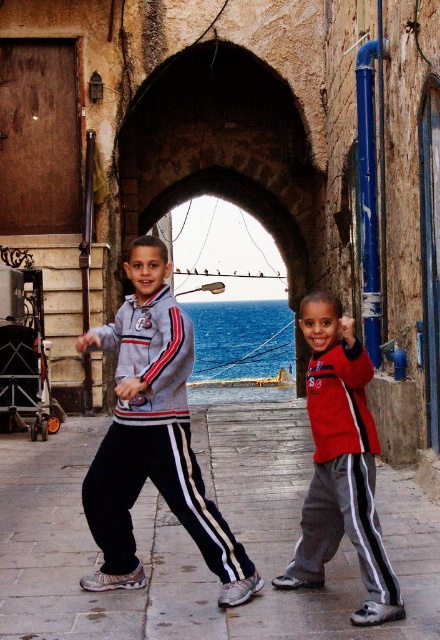
You are a photographer trying to capture a photo of the two boys in the alleyway. You want to ensure that both the stone archway at center and the red matte jacket at center are clearly visible in the frame. Based on their positions, which object should you focus on first to ensure both are in the shot?

The stone archway at center is positioned on the left side of the red matte jacket at center. To ensure both are in the frame, focus on the stone archway at center first as it is closer to the edge, allowing the red matte jacket at center to naturally fall into the shot.

You are a photographer standing at the entrance of the alleyway. You want to take a photo of the stone archway at center and the matte gray sweatshirt at left. If your camera has a maximum focus range of 60 feet, will both subjects be in focus?

The stone archway at center is 60.65 feet away from the matte gray sweatshirt at left. Since the distance between them exceeds the camera maximum focus range of 60 feet, the camera cannot focus on both subjects simultaneously.